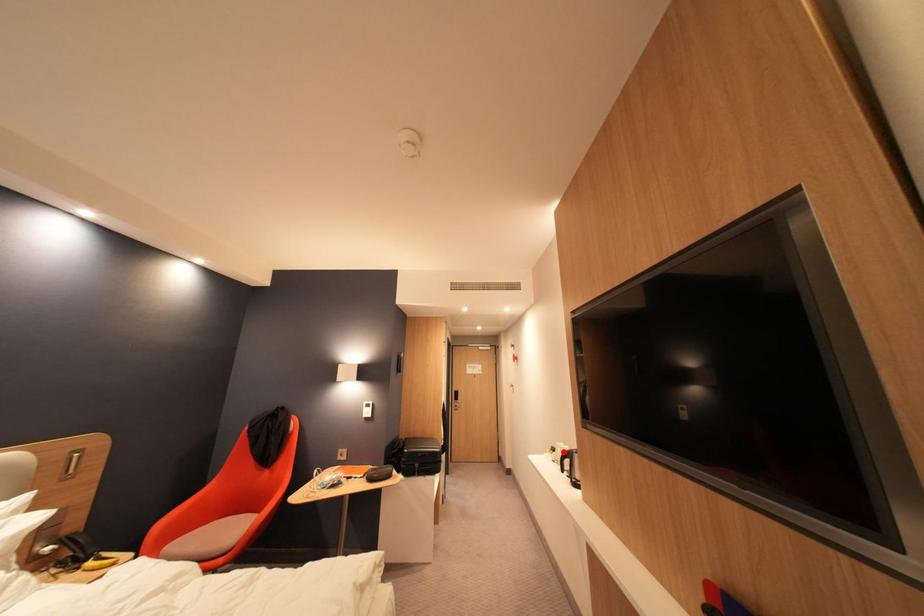
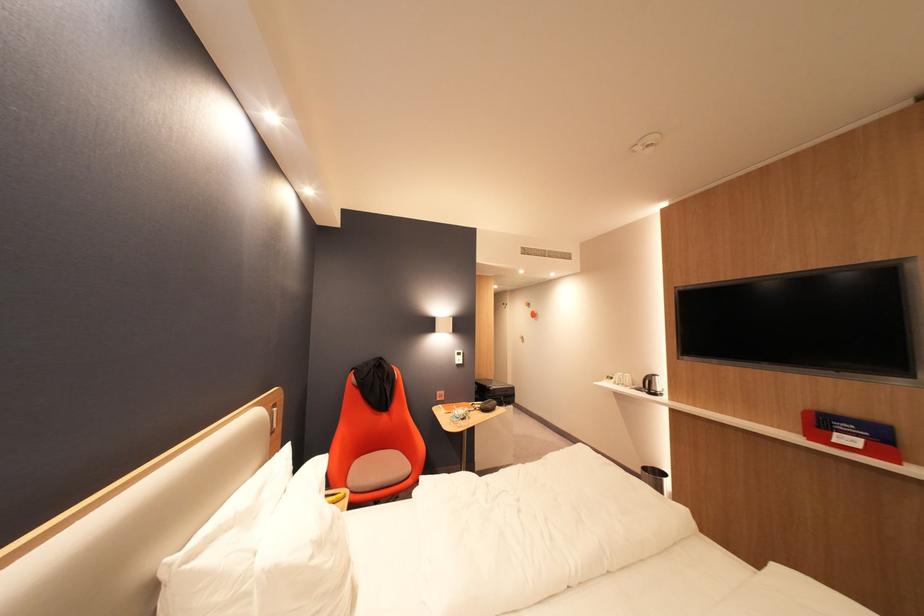
The point at the highlighted location is marked in the first image. Where is the corresponding point in the second image?

(622, 379)